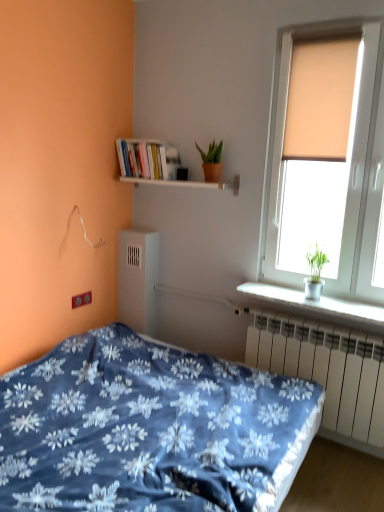
At what (x,y) coordinates should I click in order to perform the action: click on free spot above white plastic pot at right, the first window sill in the bottom-to-top sequence (from a real-world perspective). Please return your answer as a coordinate pair (x, y). Image resolution: width=384 pixels, height=512 pixels. Looking at the image, I should click on [330, 298].